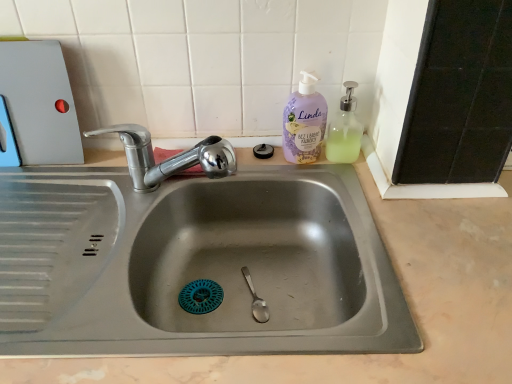
Question: Does chrome metallic faucet at upper left lie in front of lavender-colored pump bottle at upper right?

Choices:
 (A) no
 (B) yes

Answer: (B)

Question: From a real-world perspective, is chrome metallic faucet at upper left beneath lavender-colored pump bottle at upper right?

Choices:
 (A) yes
 (B) no

Answer: (A)

Question: Does chrome metallic faucet at upper left have a lesser width compared to lavender-colored pump bottle at upper right?

Choices:
 (A) no
 (B) yes

Answer: (A)

Question: Would you say lavender-colored pump bottle at upper right is part of chrome metallic faucet at upper left's contents?

Choices:
 (A) no
 (B) yes

Answer: (A)

Question: Considering the relative sizes of chrome metallic faucet at upper left and lavender-colored pump bottle at upper right in the image provided, is chrome metallic faucet at upper left bigger than lavender-colored pump bottle at upper right?

Choices:
 (A) yes
 (B) no

Answer: (A)

Question: From the image's perspective, relative to clear plastic soap dispenser at upper right, is lavender-colored pump bottle at upper right above or below?

Choices:
 (A) below
 (B) above

Answer: (B)

Question: Would you say lavender-colored pump bottle at upper right is to the left or to the right of clear plastic soap dispenser at upper right in the picture?

Choices:
 (A) left
 (B) right

Answer: (A)

Question: Choose the correct answer: Is lavender-colored pump bottle at upper right inside clear plastic soap dispenser at upper right or outside it?

Choices:
 (A) inside
 (B) outside

Answer: (B)

Question: In terms of width, does lavender-colored pump bottle at upper right look wider or thinner when compared to clear plastic soap dispenser at upper right?

Choices:
 (A) thin
 (B) wide

Answer: (A)

Question: Is clear plastic soap dispenser at upper right inside or outside of chrome metallic faucet at upper left?

Choices:
 (A) inside
 (B) outside

Answer: (B)

Question: Based on their sizes in the image, would you say clear plastic soap dispenser at upper right is bigger or smaller than chrome metallic faucet at upper left?

Choices:
 (A) big
 (B) small

Answer: (B)

Question: From a real-world perspective, relative to chrome metallic faucet at upper left, is clear plastic soap dispenser at upper right vertically above or below?

Choices:
 (A) above
 (B) below

Answer: (A)

Question: Considering their positions, is clear plastic soap dispenser at upper right located in front of or behind chrome metallic faucet at upper left?

Choices:
 (A) behind
 (B) front

Answer: (A)

Question: From the image's perspective, is lavender-colored pump bottle at upper right above or below matte plastic cutting board at upper left?

Choices:
 (A) below
 (B) above

Answer: (A)

Question: Considering the positions of point (300, 134) and point (26, 82), is point (300, 134) closer or farther from the camera than point (26, 82)?

Choices:
 (A) closer
 (B) farther

Answer: (B)